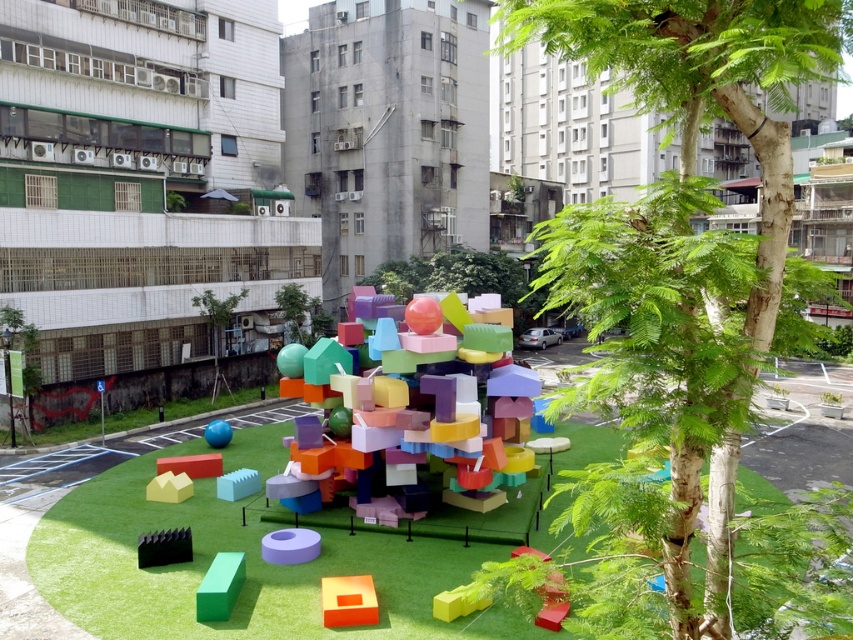
You are standing in the public square and want to take a photo of the green matte block at lower left and the matte purple ring at lower center. Which object should you focus on first to ensure both are in frame without moving the camera?

You should focus on the green matte block at lower left first since it is closer to you than the matte purple ring at lower center, so keeping it in focus will help both objects remain in the frame.

You are a child visiting the sculpture and want to play with the objects. Which object can you place your hand around more easily, the matte plastic colorful blocks at center or the glossy plastic ball at center?

The matte plastic colorful blocks at center has a smaller size compared to glossy plastic ball at center, so you can place your hand around the matte plastic colorful blocks at center more easily.

You are standing in the public square and want to place a new bench. The bench requires a clear space of 2 meters by 2 meters. Is there enough space at the green matte grass at center to accommodate the bench?

The green matte grass at center is located at point (247, 564). Since the coordinates indicate a specific location, there is likely enough space for the bench as long as no other objects are in the way. However, the description does not mention any obstructions, so it should be feasible.